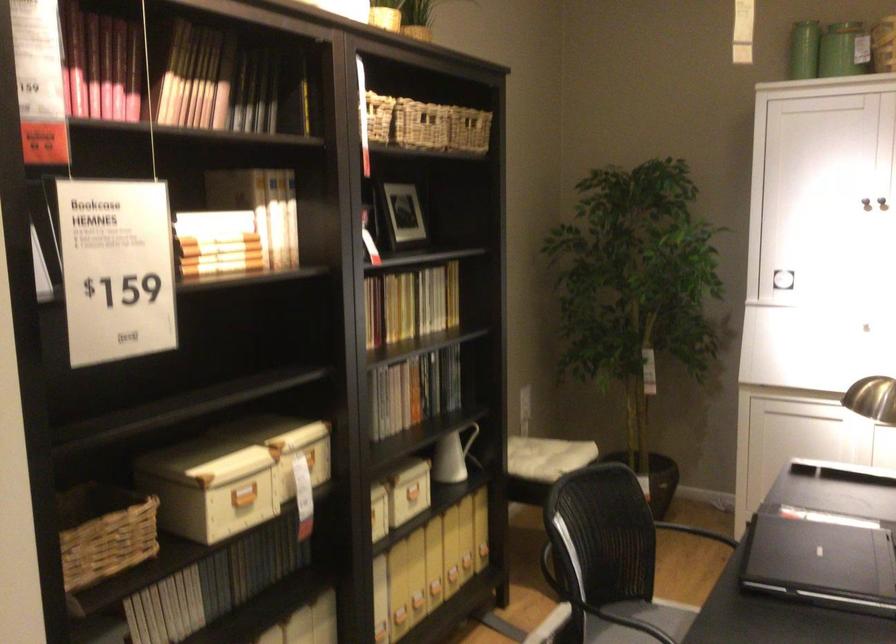
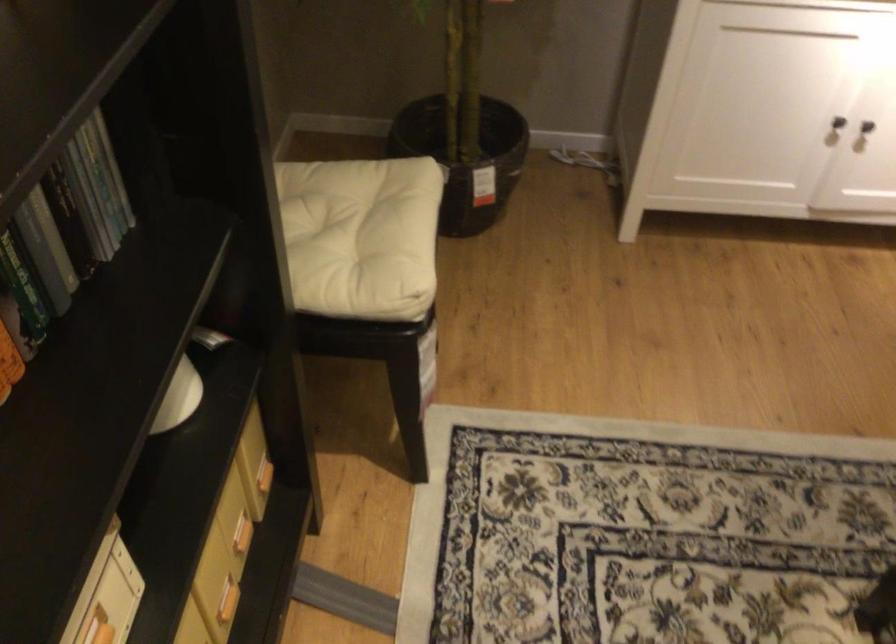
In the second image, find the point that corresponds to point (426, 391) in the first image.

(30, 240)